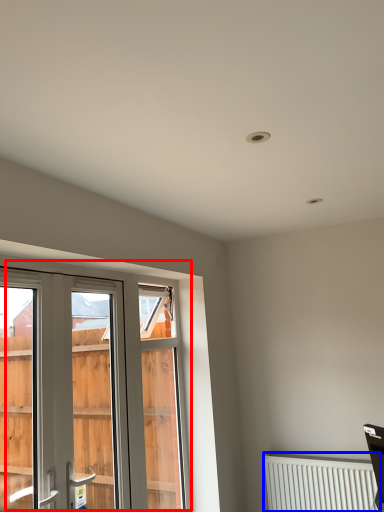
Question: Which of the following is the farthest to the observer, window (highlighted by a red box) or radiator (highlighted by a blue box)?

Choices:
 (A) window
 (B) radiator

Answer: (B)